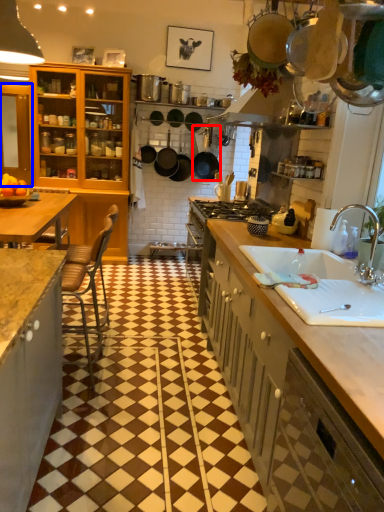
Question: Among these objects, which one is nearest to the camera, kitchen appliance (highlighted by a red box) or cabinetry (highlighted by a blue box)?

Choices:
 (A) kitchen appliance
 (B) cabinetry

Answer: (B)